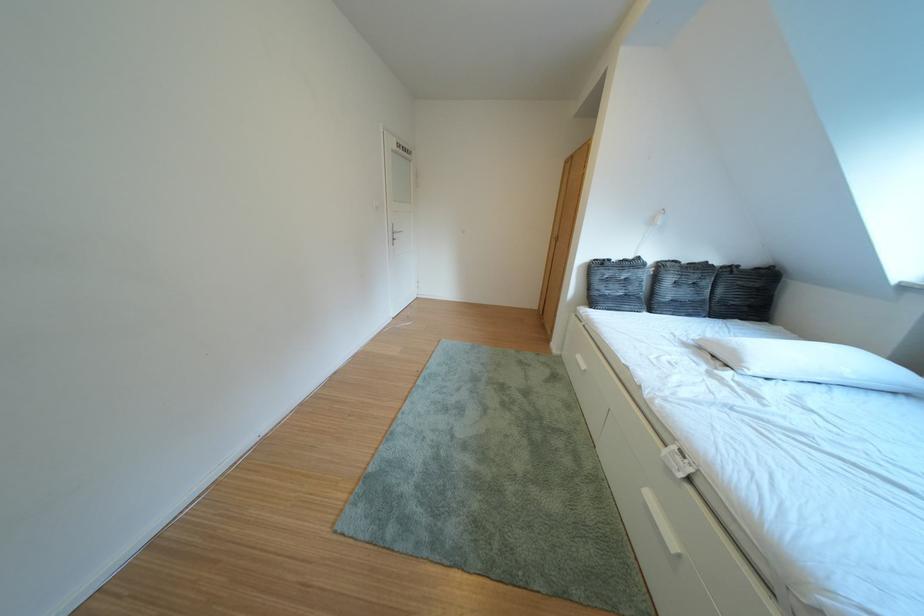
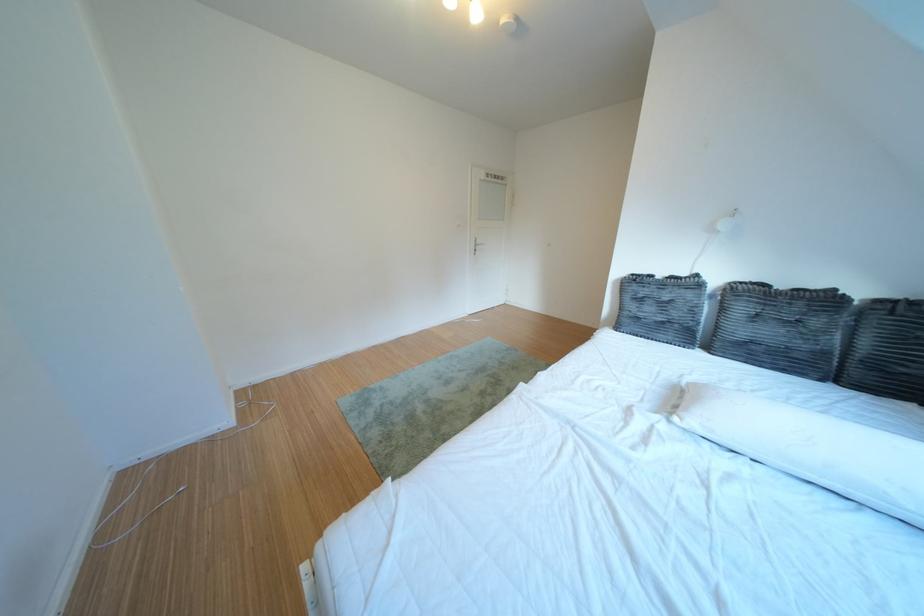
Where in the second image is the point corresponding to point (610, 299) from the first image?

(639, 318)